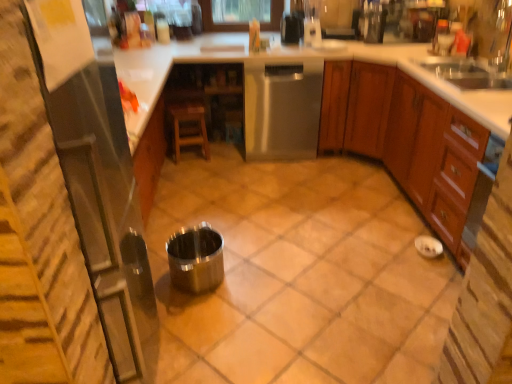
Find the location of a particular element. vacant area on top of metallic silver at center (from a real-world perspective) is located at coordinates (292, 232).